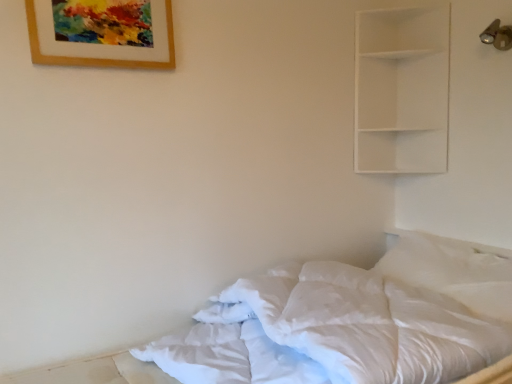
The image size is (512, 384). What do you see at coordinates (102, 33) in the screenshot? I see `wooden picture frame at upper left` at bounding box center [102, 33].

The image size is (512, 384). Describe the element at coordinates (86, 371) in the screenshot. I see `white soft bed at lower right` at that location.

The image size is (512, 384). What do you see at coordinates (401, 90) in the screenshot? I see `white matte shelf at upper right` at bounding box center [401, 90].

The width and height of the screenshot is (512, 384). I want to click on white matte shelf at upper right, so click(401, 90).

Locate an element on the screen. This screenshot has height=384, width=512. wooden picture frame at upper left is located at coordinates (102, 33).

From the image's perspective, is white soft bed at lower right positioned above or below wooden picture frame at upper left?

Clearly, from the image's perspective, white soft bed at lower right is below wooden picture frame at upper left.

In terms of height, does white soft bed at lower right look taller or shorter compared to wooden picture frame at upper left?

Clearly, white soft bed at lower right is taller compared to wooden picture frame at upper left.

From a real-world perspective, does white soft bed at lower right sit lower than wooden picture frame at upper left?

Yes, from a real-world perspective, white soft bed at lower right is beneath wooden picture frame at upper left.

Are white soft bed at lower right and wooden picture frame at upper left making contact?

No, white soft bed at lower right is not making contact with wooden picture frame at upper left.

Between white matte shelf at upper right and wooden picture frame at upper left, which one has more height?

With more height is white matte shelf at upper right.

Is white matte shelf at upper right not near wooden picture frame at upper left?

Yes.

Considering the relative positions of white matte shelf at upper right and wooden picture frame at upper left in the image provided, is white matte shelf at upper right to the left or to the right of wooden picture frame at upper left?

In the image, white matte shelf at upper right appears on the right side of wooden picture frame at upper left.

Does point (359, 104) come farther from viewer compared to point (56, 58)?

Yes, it is behind point (56, 58).

Could you tell me if wooden picture frame at upper left is facing white soft bed at lower right?

No, wooden picture frame at upper left is not oriented towards white soft bed at lower right.

From the image's perspective, is wooden picture frame at upper left above or below white soft bed at lower right?

wooden picture frame at upper left is above white soft bed at lower right.

Considering the relative sizes of wooden picture frame at upper left and white soft bed at lower right in the image provided, is wooden picture frame at upper left bigger than white soft bed at lower right?

No.

Considering the positions of objects wooden picture frame at upper left and white soft bed at lower right in the image provided, who is behind, wooden picture frame at upper left or white soft bed at lower right?

wooden picture frame at upper left.

Which is behind, white soft bed at lower right or white matte shelf at upper right?

white matte shelf at upper right is behind.

Is white soft bed at lower right oriented towards white matte shelf at upper right?

No, white soft bed at lower right is not turned towards white matte shelf at upper right.

Is white soft bed at lower right spatially inside white matte shelf at upper right, or outside of it?

white soft bed at lower right exists outside the volume of white matte shelf at upper right.

Does white soft bed at lower right have a smaller size compared to white matte shelf at upper right?

Incorrect, white soft bed at lower right is not smaller in size than white matte shelf at upper right.

Is wooden picture frame at upper left bigger or smaller than white matte shelf at upper right?

Clearly, wooden picture frame at upper left is smaller in size than white matte shelf at upper right.

Identify the location of picture frame that appears on the left of white matte shelf at upper right. (102, 33).

From the image's perspective, which one is positioned lower, wooden picture frame at upper left or white matte shelf at upper right?

white matte shelf at upper right, from the image's perspective.

Is white matte shelf at upper right inside wooden picture frame at upper left?

No, white matte shelf at upper right is not a part of wooden picture frame at upper left.

Which object is wider, white matte shelf at upper right or white soft bed at lower right?

Wider between the two is white soft bed at lower right.

Does white matte shelf at upper right have a larger size compared to white soft bed at lower right?

No.

Where is `bed below the wooden picture frame at upper left (from a real-world perspective)`? The width and height of the screenshot is (512, 384). bed below the wooden picture frame at upper left (from a real-world perspective) is located at coordinates (86, 371).

Where is `picture frame on the left of white matte shelf at upper right`? The width and height of the screenshot is (512, 384). picture frame on the left of white matte shelf at upper right is located at coordinates (102, 33).

Based on their spatial positions, is wooden picture frame at upper left or white soft bed at lower right further from white matte shelf at upper right?

white soft bed at lower right lies further to white matte shelf at upper right than the other object.

When comparing their distances from white matte shelf at upper right, does white soft bed at lower right or wooden picture frame at upper left seem closer?

Among the two, wooden picture frame at upper left is located nearer to white matte shelf at upper right.

Based on their spatial positions, is wooden picture frame at upper left or white matte shelf at upper right further from white soft bed at lower right?

Among the two, white matte shelf at upper right is located further to white soft bed at lower right.

Based on their spatial positions, is white matte shelf at upper right or wooden picture frame at upper left further from white soft bed at lower right?

white matte shelf at upper right is positioned further to the anchor white soft bed at lower right.

Which object lies further to the anchor point wooden picture frame at upper left, white soft bed at lower right or white matte shelf at upper right?

white matte shelf at upper right is further to wooden picture frame at upper left.

Which object lies further to the anchor point wooden picture frame at upper left, white matte shelf at upper right or white soft bed at lower right?

white matte shelf at upper right.

You are a GUI agent. You are given a task and a screenshot of the screen. Output one action in this format:
    pyautogui.click(x=<x>, y=<y>)
    Task: Click on the picture frame between white soft bed at lower right and white matte shelf at upper right along the z-axis
    
    Given the screenshot: What is the action you would take?
    [102, 33]